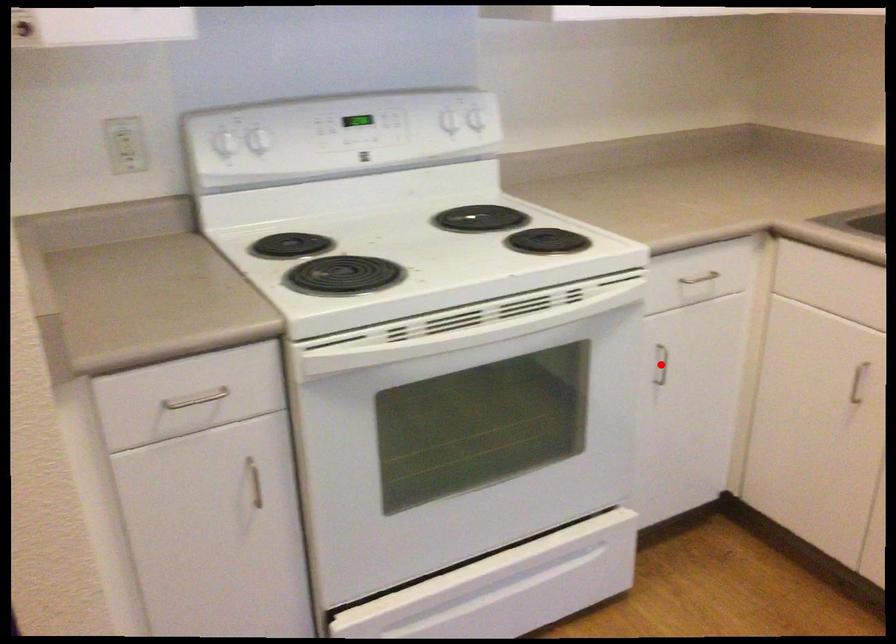
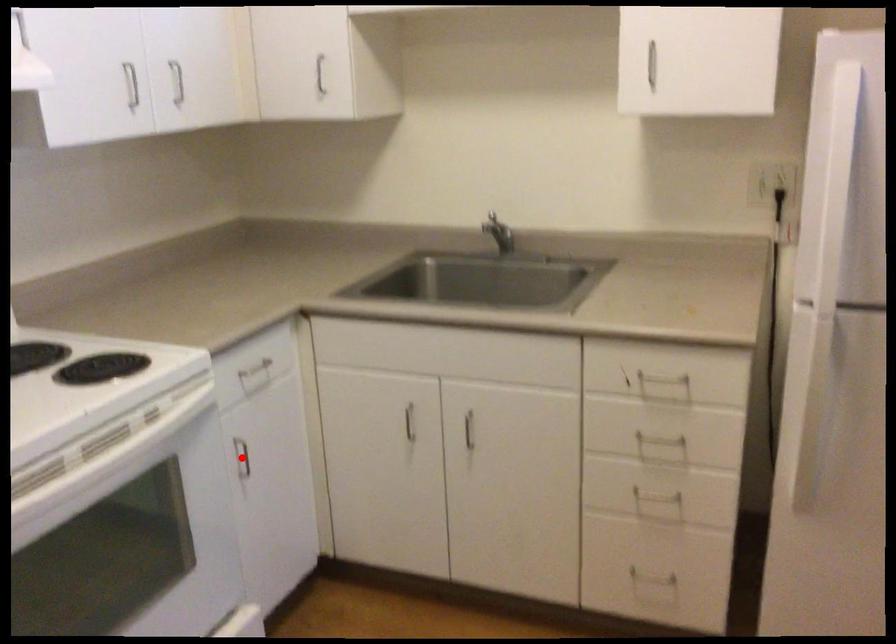
I am providing you with two images of the same scene from different viewpoints. A red point is marked on the first image and another point is marked on the second image. Do the highlighted points in image1 and image2 indicate the same real-world spot?

Yes